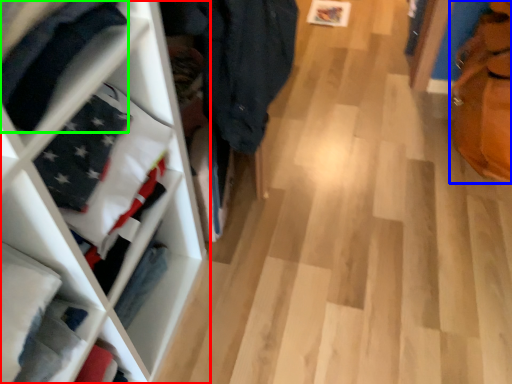
Question: Which object is positioned closest to shelf (highlighted by a red box)? Select from tote bag (highlighted by a blue box) and clothing (highlighted by a green box).

Choices:
 (A) tote bag
 (B) clothing

Answer: (B)